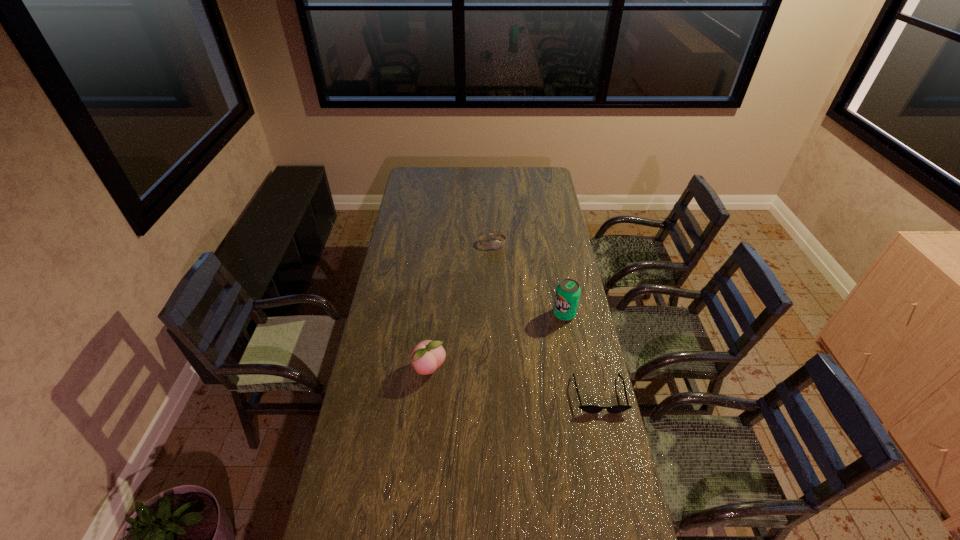
This screenshot has height=540, width=960. Find the location of `free space on the desktop that is between the second tallest object and the sunglasses and is positioned on the front-facing side of the third nearest object`. free space on the desktop that is between the second tallest object and the sunglasses and is positioned on the front-facing side of the third nearest object is located at coordinates (495, 379).

This screenshot has width=960, height=540. I want to click on free spot on the desktop that is between the peach and the shortest object and is positioned on the face of the watch, so click(x=534, y=384).